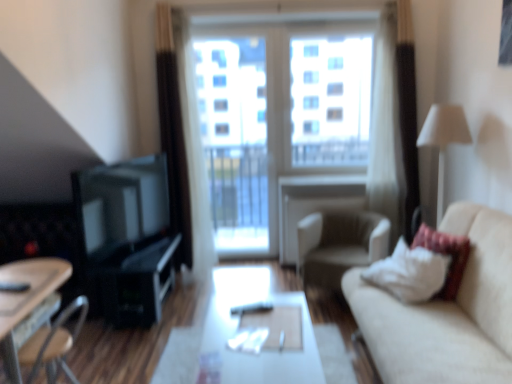
Where is `free space above white glossy table at center, the first table from the right (from a real-world perspective)`? Image resolution: width=512 pixels, height=384 pixels. free space above white glossy table at center, the first table from the right (from a real-world perspective) is located at coordinates (256, 355).